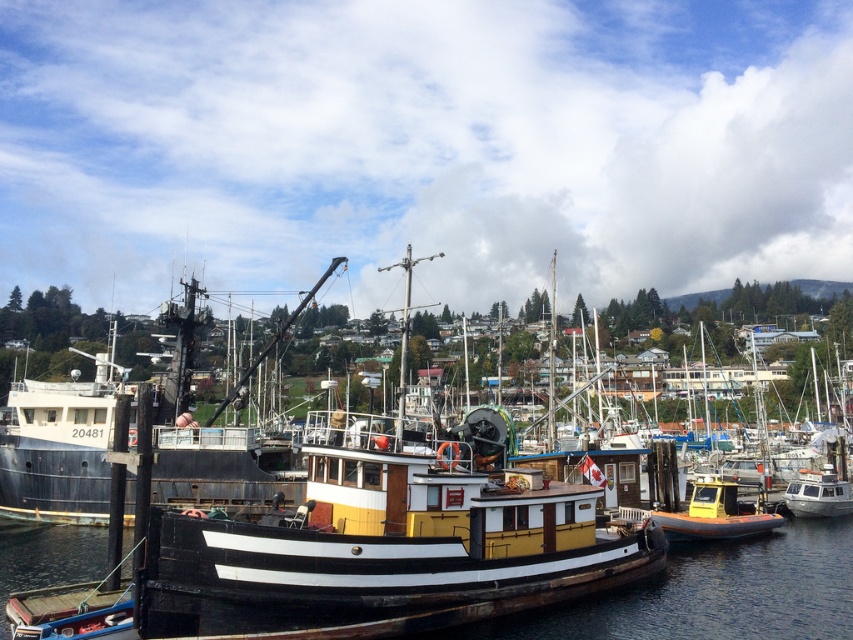
You are standing on the pier and see the yellow matte boat at center and the black wood boat at center. Which boat is positioned higher relative to the other?

The yellow matte boat at center is located above the black wood boat at center, so it is positioned higher.

You are standing on the pier and want to board the yellow matte boat at center and the black wood boat at center. Which boat should you approach first to board the closer one?

You should approach the yellow matte boat at center first because it is closer to you than the black wood boat at center.